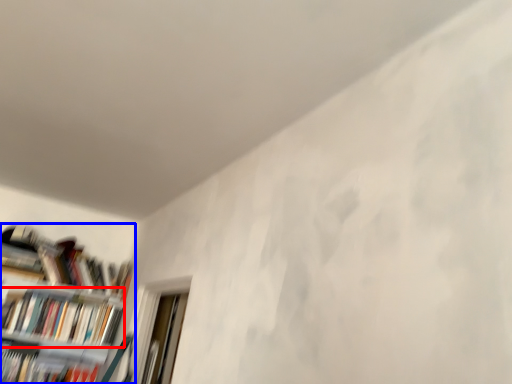
Question: Which object is closer to the camera taking this photo, book (highlighted by a red box) or bookcase (highlighted by a blue box)?

Choices:
 (A) book
 (B) bookcase

Answer: (B)